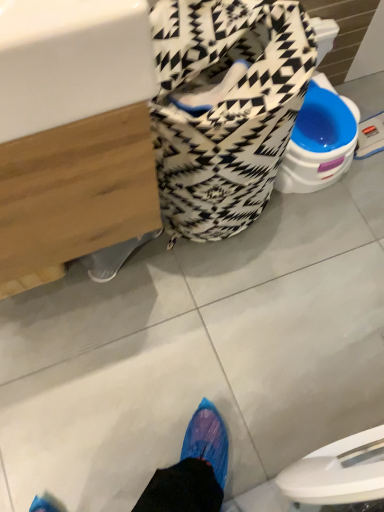
Question: Considering their positions, is patterned fabric laundry basket at center located in front of or behind white glossy sink at upper left?

Choices:
 (A) front
 (B) behind

Answer: (B)

Question: Would you say patterned fabric laundry basket at center is inside or outside white glossy sink at upper left?

Choices:
 (A) inside
 (B) outside

Answer: (B)

Question: In terms of width, does patterned fabric laundry basket at center look wider or thinner when compared to white glossy sink at upper left?

Choices:
 (A) thin
 (B) wide

Answer: (A)

Question: Is white glossy sink at upper left wider or thinner than patterned fabric laundry basket at center?

Choices:
 (A) wide
 (B) thin

Answer: (A)

Question: From the image's perspective, relative to patterned fabric laundry basket at center, is white glossy sink at upper left above or below?

Choices:
 (A) below
 (B) above

Answer: (A)

Question: From a real-world perspective, is white glossy sink at upper left physically located above or below patterned fabric laundry basket at center?

Choices:
 (A) above
 (B) below

Answer: (A)

Question: Is white glossy sink at upper left taller or shorter than patterned fabric laundry basket at center?

Choices:
 (A) tall
 (B) short

Answer: (A)